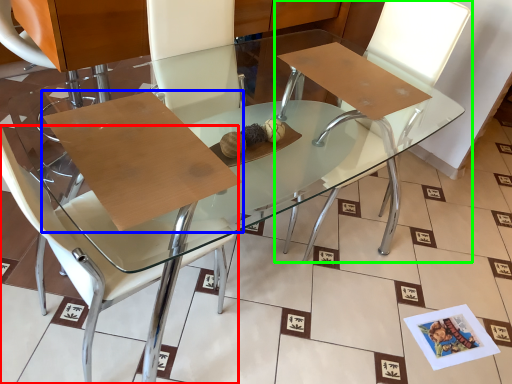
Question: Estimate the real-world distances between objects in this image. Which object is closer to chair (highlighted by a red box), cardboard (highlighted by a blue box) or chair (highlighted by a green box)?

Choices:
 (A) cardboard
 (B) chair

Answer: (A)